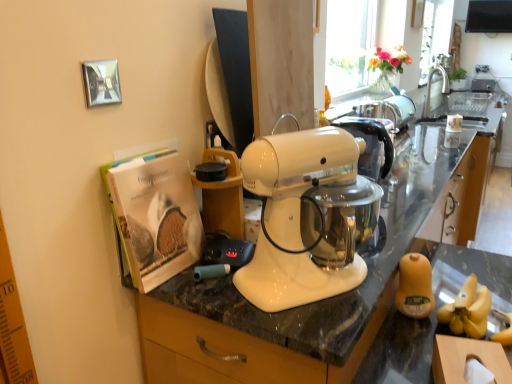
What is the approximate height of silver metallic faucet at upper right?

The height of silver metallic faucet at upper right is 15.19 inches.

Locate an element on the screen. This screenshot has height=384, width=512. matte paper magazine at left is located at coordinates (155, 216).

From a real-world perspective, is yellow matte jar at lower right located higher than white glossy countertop at center?

Yes.

Would you consider yellow matte jar at lower right to be distant from white glossy countertop at center?

yellow matte jar at lower right is near white glossy countertop at center, not far away.

From the image's perspective, which one is positioned higher, yellow matte jar at lower right or white glossy countertop at center?

From the image's view, yellow matte jar at lower right is above.

Based on the photo, does yellow matte jar at lower right appear on the right side of white glossy countertop at center?

No, yellow matte jar at lower right is not to the right of white glossy countertop at center.

In the image, is silver metallic faucet at upper right on the left side or the right side of yellow matte jar at lower right?

silver metallic faucet at upper right is to the right of yellow matte jar at lower right.

Is point (437, 73) farther from camera compared to point (414, 295)?

That is True.

Between silver metallic faucet at upper right and yellow matte jar at lower right, which one is positioned behind?

silver metallic faucet at upper right is more distant.

Are silver metallic faucet at upper right and white glossy countertop at center beside each other?

They are not placed beside each other.

From a real-world perspective, is silver metallic faucet at upper right over white glossy countertop at center?

Yes.

Locate an element on the screen. Image resolution: width=512 pixels, height=384 pixels. countertop below the silver metallic faucet at upper right (from a real-world perspective) is located at coordinates click(x=359, y=252).

How many degrees apart are the facing directions of white glossy countertop at center and matte paper magazine at left?

The facing directions of white glossy countertop at center and matte paper magazine at left are 0.000614 degrees apart.

Find the location of a particular element. The image size is (512, 384). magazine above the white glossy countertop at center (from the image's perspective) is located at coordinates (155, 216).

Does point (415, 206) lie behind point (148, 259)?

That is True.

From the image's perspective, which is above, white glossy countertop at center or matte paper magazine at left?

matte paper magazine at left, from the image's perspective.

Is matte paper magazine at left facing towards yellow matte jar at lower right?

No, matte paper magazine at left is not oriented towards yellow matte jar at lower right.

Is matte paper magazine at left to the left of yellow matte jar at lower right from the viewer's perspective?

Correct, you'll find matte paper magazine at left to the left of yellow matte jar at lower right.

Is matte paper magazine at left taller or shorter than yellow matte jar at lower right?

Considering their sizes, matte paper magazine at left has more height than yellow matte jar at lower right.

Which is nearer, (138, 276) or (433, 303)?

Point (138, 276) is closer to the camera than point (433, 303).

Can you confirm if matte paper magazine at left is thinner than white glossy countertop at center?

Yes, matte paper magazine at left is thinner than white glossy countertop at center.

Is matte paper magazine at left positioned beyond the bounds of white glossy countertop at center?

Absolutely, matte paper magazine at left is external to white glossy countertop at center.

Is matte paper magazine at left aimed at white glossy countertop at center?

No, matte paper magazine at left is not facing towards white glossy countertop at center.

Can you tell me how much matte paper magazine at left and white glossy countertop at center differ in facing direction?

They differ by 0.000614 degrees in their facing directions.

Does white glossy countertop at center come behind silver metallic faucet at upper right?

No, white glossy countertop at center is in front of silver metallic faucet at upper right.

From the image's perspective, between white glossy countertop at center and silver metallic faucet at upper right, which one is located above?

silver metallic faucet at upper right appears higher in the image.

Where is `countertop below the silver metallic faucet at upper right (from the image's perspective)`? countertop below the silver metallic faucet at upper right (from the image's perspective) is located at coordinates (359, 252).

Can you confirm if white glossy countertop at center is thinner than silver metallic faucet at upper right?

Incorrect, the width of white glossy countertop at center is not less than that of silver metallic faucet at upper right.

This screenshot has height=384, width=512. Identify the location of countertop in front of the yellow matte jar at lower right. (359, 252).

In the image, there is a silver metallic faucet at upper right. In order to click on food below it (from the image's perspective) in this screenshot , I will do `click(415, 286)`.

Based on their spatial positions, is yellow matte jar at lower right or matte paper magazine at left further from silver metallic faucet at upper right?

The object further to silver metallic faucet at upper right is matte paper magazine at left.

Based on their spatial positions, is silver metallic faucet at upper right or yellow matte jar at lower right further from white glossy countertop at center?

The object further to white glossy countertop at center is silver metallic faucet at upper right.

Looking at the image, which one is located closer to yellow matte jar at lower right, matte paper magazine at left or white glossy countertop at center?

The object closer to yellow matte jar at lower right is white glossy countertop at center.

Looking at the image, which one is located further to silver metallic faucet at upper right, yellow matte jar at lower right or white glossy countertop at center?

yellow matte jar at lower right is further to silver metallic faucet at upper right.

Looking at the image, which one is located further to white glossy countertop at center, matte paper magazine at left or yellow matte jar at lower right?

Based on the image, yellow matte jar at lower right appears to be further to white glossy countertop at center.

Estimate the real-world distances between objects in this image. Which object is closer to yellow matte jar at lower right, silver metallic faucet at upper right or matte paper magazine at left?

matte paper magazine at left.

Which object lies nearer to the anchor point yellow matte jar at lower right, white glossy countertop at center or matte paper magazine at left?

white glossy countertop at center.

Looking at the image, which one is located further to matte paper magazine at left, silver metallic faucet at upper right or white glossy countertop at center?

The object further to matte paper magazine at left is silver metallic faucet at upper right.

Find the location of a particular element. This screenshot has height=384, width=512. food positioned between white glossy countertop at center and silver metallic faucet at upper right from near to far is located at coordinates (415, 286).

You are a GUI agent. You are given a task and a screenshot of the screen. Output one action in this format:
    pyautogui.click(x=<x>, y=<y>)
    Task: Click on the magazine positioned between white glossy countertop at center and silver metallic faucet at upper right from near to far
    The image size is (512, 384).
    Given the screenshot: What is the action you would take?
    click(155, 216)

The height and width of the screenshot is (384, 512). I want to click on food situated between matte paper magazine at left and white glossy countertop at center from left to right, so click(415, 286).

You are a GUI agent. You are given a task and a screenshot of the screen. Output one action in this format:
    pyautogui.click(x=<x>, y=<y>)
    Task: Click on the food located between matte paper magazine at left and silver metallic faucet at upper right in the depth direction
    The height and width of the screenshot is (384, 512).
    Given the screenshot: What is the action you would take?
    pyautogui.click(x=415, y=286)